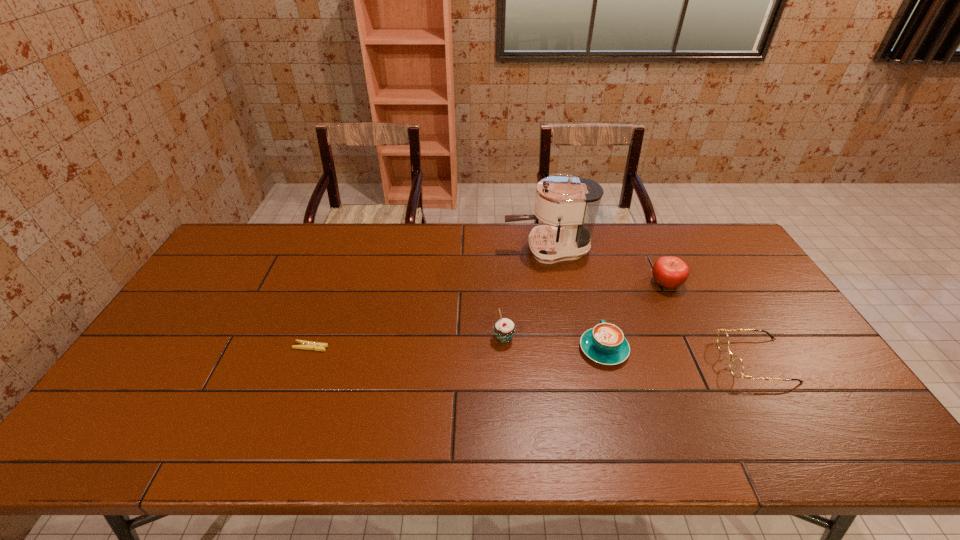
This screenshot has width=960, height=540. In order to click on vacant area that satisfies the following two spatial constraints: 1. on the front-facing side of the coffee maker; 2. with the handle on the right side of the cappuccino in this screenshot , I will do `click(566, 349)`.

At what (x,y) coordinates should I click in order to perform the action: click on free region that satisfies the following two spatial constraints: 1. with the handle on the right side of the cappuccino; 2. on the front-facing side of the tallest object. Please return your answer as a coordinate pair (x, y). The image size is (960, 540). Looking at the image, I should click on (577, 249).

Locate an element on the screen. The image size is (960, 540). vacant region that satisfies the following two spatial constraints: 1. with the handle on the right side of the cappuccino; 2. on the front-facing side of the tallest object is located at coordinates (577, 249).

This screenshot has height=540, width=960. I want to click on free location that satisfies the following two spatial constraints: 1. on the back side of the apple; 2. on the front-facing side of the farthest object, so click(x=651, y=249).

You are a GUI agent. You are given a task and a screenshot of the screen. Output one action in this format:
    pyautogui.click(x=<x>, y=<y>)
    Task: Click on the vacant space that satisfies the following two spatial constraints: 1. with the handle on the right side of the second object from right to left; 2. on the right side of the cappuccino
    Image resolution: width=960 pixels, height=540 pixels.
    Given the screenshot: What is the action you would take?
    (x=586, y=283)